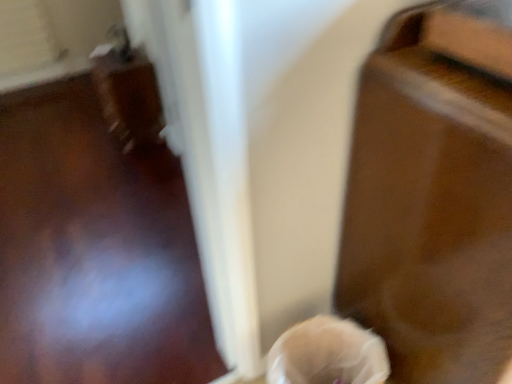
What do you see at coordinates (328, 354) in the screenshot?
I see `translucent plastic bag at lower center` at bounding box center [328, 354].

Where is `translucent plastic bag at lower center`? Image resolution: width=512 pixels, height=384 pixels. translucent plastic bag at lower center is located at coordinates (328, 354).

Measure the distance between glossy wood table at right and camera.

The depth of glossy wood table at right is 63.15 centimeters.

The image size is (512, 384). I want to click on glossy wood table at right, so pos(433,195).

What do you see at coordinates (433, 195) in the screenshot? Image resolution: width=512 pixels, height=384 pixels. I see `glossy wood table at right` at bounding box center [433, 195].

Image resolution: width=512 pixels, height=384 pixels. I want to click on translucent plastic bag at lower center, so click(328, 354).

From the picture: Does glossy wood table at right appear on the left side of translucent plastic bag at lower center?

No.

Is glossy wood table at right further to the viewer compared to translucent plastic bag at lower center?

No, the depth of glossy wood table at right is less than that of translucent plastic bag at lower center.

Is point (482, 85) closer to viewer compared to point (351, 343)?

Yes, point (482, 85) is in front of point (351, 343).

From the image's perspective, which is above, glossy wood table at right or translucent plastic bag at lower center?

glossy wood table at right.

From a real-world perspective, is glossy wood table at right under translucent plastic bag at lower center?

No.

In terms of width, does glossy wood table at right look wider or thinner when compared to translucent plastic bag at lower center?

Considering their sizes, glossy wood table at right looks broader than translucent plastic bag at lower center.

Does glossy wood table at right have a greater height compared to translucent plastic bag at lower center?

Indeed, glossy wood table at right has a greater height compared to translucent plastic bag at lower center.

Who is smaller, glossy wood table at right or translucent plastic bag at lower center?

Smaller between the two is translucent plastic bag at lower center.

Is translucent plastic bag at lower center surrounded by glossy wood table at right?

No, translucent plastic bag at lower center is located outside of glossy wood table at right.

Looking at this image, is glossy wood table at right touching translucent plastic bag at lower center?

glossy wood table at right and translucent plastic bag at lower center are not in contact.

Is glossy wood table at right aimed at translucent plastic bag at lower center?

No, glossy wood table at right is not turned towards translucent plastic bag at lower center.

How different are the orientations of glossy wood table at right and translucent plastic bag at lower center in degrees?

88.5 degrees.

I want to click on furniture above the translucent plastic bag at lower center (from the image's perspective), so click(433, 195).

Which object is positioned more to the left, translucent plastic bag at lower center or glossy wood table at right?

Positioned to the left is translucent plastic bag at lower center.

Is translucent plastic bag at lower center further to the viewer compared to glossy wood table at right?

Yes, it is.

Which point is more distant from viewer, (x=286, y=378) or (x=411, y=336)?

The point (x=286, y=378) is behind.

In the scene shown: From the image's perspective, is translucent plastic bag at lower center positioned above or below glossy wood table at right?

Clearly, from the image's perspective, translucent plastic bag at lower center is below glossy wood table at right.

From a real-world perspective, does translucent plastic bag at lower center sit lower than glossy wood table at right?

Yes, from a real-world perspective, translucent plastic bag at lower center is beneath glossy wood table at right.

Considering the sizes of translucent plastic bag at lower center and glossy wood table at right in the image, is translucent plastic bag at lower center wider or thinner than glossy wood table at right?

Considering their sizes, translucent plastic bag at lower center looks slimmer than glossy wood table at right.

Does translucent plastic bag at lower center have a greater height compared to glossy wood table at right?

No.

Looking at this image, which of these two, translucent plastic bag at lower center or glossy wood table at right, is bigger?

glossy wood table at right.

Does translucent plastic bag at lower center contain glossy wood table at right?

No, glossy wood table at right is not surrounded by translucent plastic bag at lower center.

Does translucent plastic bag at lower center touch glossy wood table at right?

There is a gap between translucent plastic bag at lower center and glossy wood table at right.

Could you tell me if translucent plastic bag at lower center is turned towards glossy wood table at right?

No.

What's the angular difference between translucent plastic bag at lower center and glossy wood table at right's facing directions?

They differ by 88.5 degrees in their facing directions.

In order to click on woman behind the glossy wood table at right in this screenshot , I will do `click(328, 354)`.

You are a GUI agent. You are given a task and a screenshot of the screen. Output one action in this format:
    pyautogui.click(x=<x>, y=<y>)
    Task: Click on the woman below the glossy wood table at right (from a real-world perspective)
    This screenshot has height=384, width=512.
    Given the screenshot: What is the action you would take?
    pyautogui.click(x=328, y=354)

The height and width of the screenshot is (384, 512). I want to click on woman lying below the glossy wood table at right (from the image's perspective), so click(328, 354).